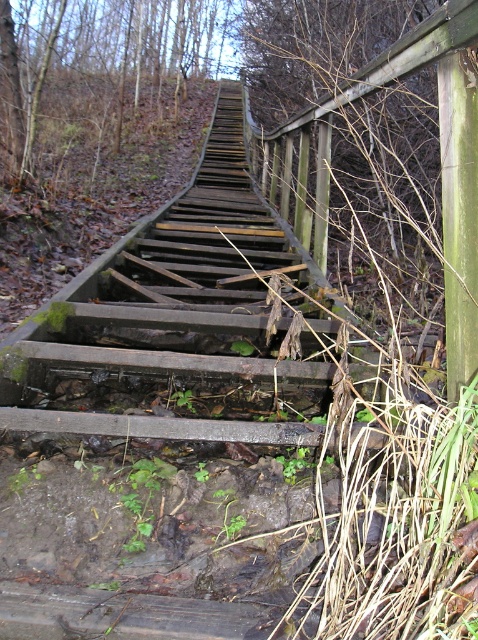
Can you confirm if weathered wood stairs at center is positioned below green leafy weed at center?

No.

Is weathered wood stairs at center thinner than green leafy weed at center?

No.

Is point (134, 371) more distant than point (174, 403)?

Yes, point (134, 371) is farther from viewer.

Find the location of a particular element. This screenshot has width=478, height=640. weathered wood stairs at center is located at coordinates (197, 326).